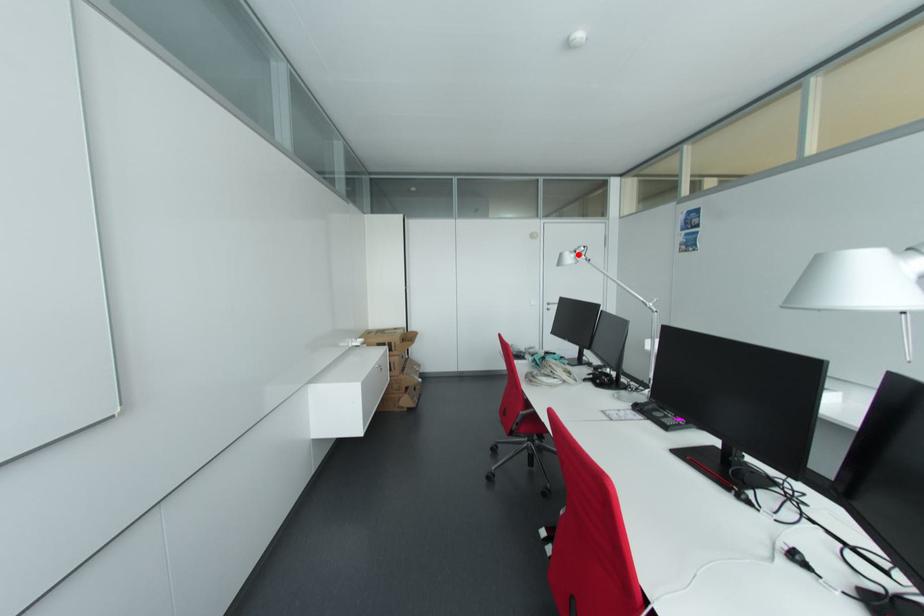
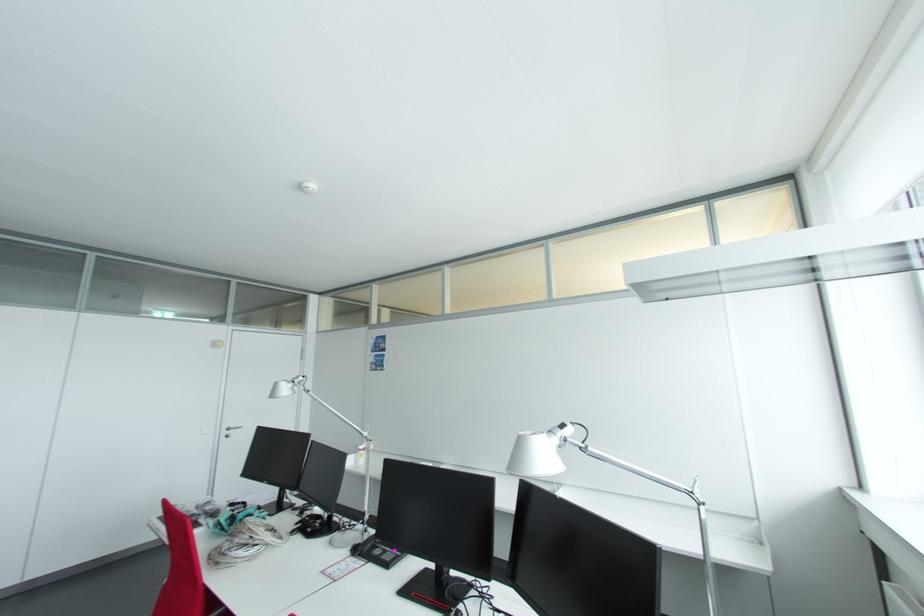
Find the pixel in the second image that matches the highlighted location in the first image.

(295, 385)